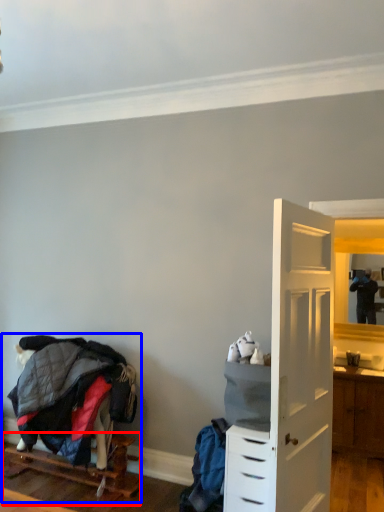
Question: Which object appears farthest to the camera in this image, furniture (highlighted by a red box) or bunk bed (highlighted by a blue box)?

Choices:
 (A) furniture
 (B) bunk bed

Answer: (B)